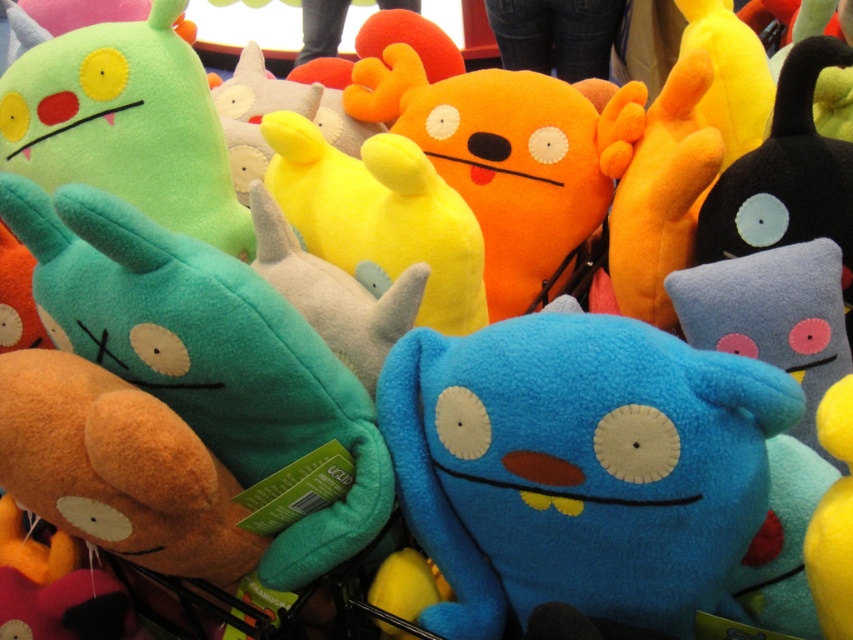
Based on the photo, you are standing in front of the vibrant collection of plush toys and want to touch the two points mentioned. Which point, point (436, 371) or point (566, 214), is closer to your hand?

Point (436, 371) is closer to the viewer than point (566, 214), so it is closer to your hand.

You are holding a measuring tape and need to determine if a 30 inch ruler can reach from your current position to the point at point (689, 593). Can it?

The distance of point (689, 593) from viewer is 28.18 inches, so yes, the ruler can reach it since it is shorter than the ruler length.